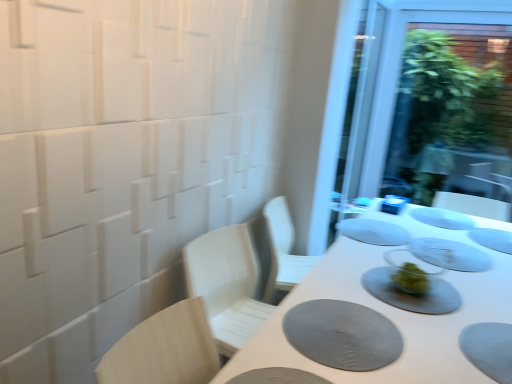
Image resolution: width=512 pixels, height=384 pixels. Find the location of `free location to the left of gray matte placemat at center, positioned as the 3th tableware in front-to-back order`. free location to the left of gray matte placemat at center, positioned as the 3th tableware in front-to-back order is located at coordinates (433, 230).